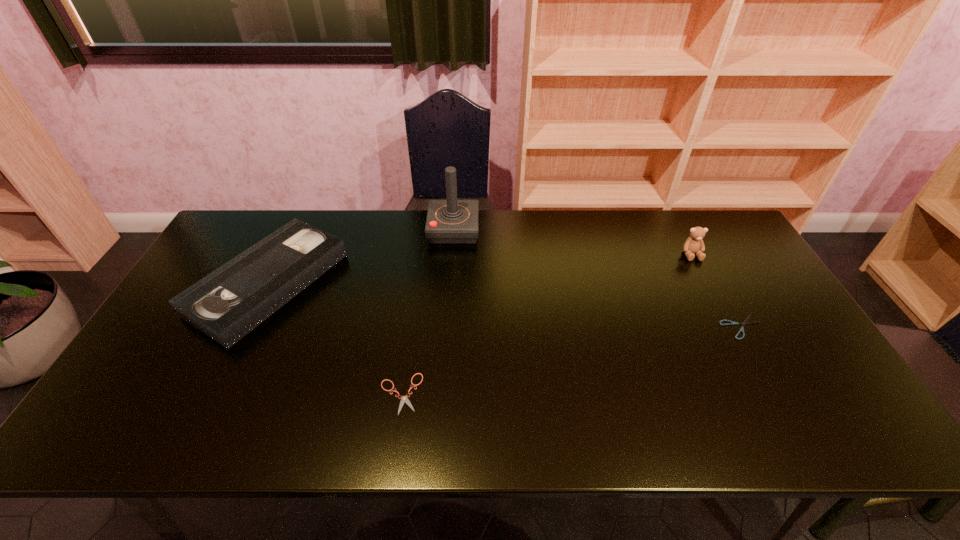
At what (x,y) coordinates should I click in order to perform the action: click on the tallest object. Please return your answer as a coordinate pair (x, y). This screenshot has width=960, height=540. Looking at the image, I should click on (451, 221).

Find the location of a particular element. teddy bear is located at coordinates (x=694, y=244).

Identify the location of videotape. This screenshot has height=540, width=960. (227, 304).

This screenshot has height=540, width=960. In order to click on the leftmost object in this screenshot , I will do `click(227, 304)`.

Locate an element on the screen. the nearer shears is located at coordinates (404, 399).

What are the coordinates of `the left shears` in the screenshot? It's located at (404, 399).

The height and width of the screenshot is (540, 960). I want to click on the right shears, so click(745, 322).

At what (x,y) coordinates should I click in order to perform the action: click on vacant area situated 0.370m on the rectangular base of the joystick. Please return your answer as a coordinate pair (x, y). The width and height of the screenshot is (960, 540). Looking at the image, I should click on click(587, 230).

You are a GUI agent. You are given a task and a screenshot of the screen. Output one action in this format:
    pyautogui.click(x=<x>, y=<y>)
    Task: Click on the vacant point located on the face of the fourth shortest object
    This screenshot has width=960, height=540.
    Given the screenshot: What is the action you would take?
    pyautogui.click(x=750, y=365)

Where is `blank space located on the right of the third tallest object`? blank space located on the right of the third tallest object is located at coordinates (434, 284).